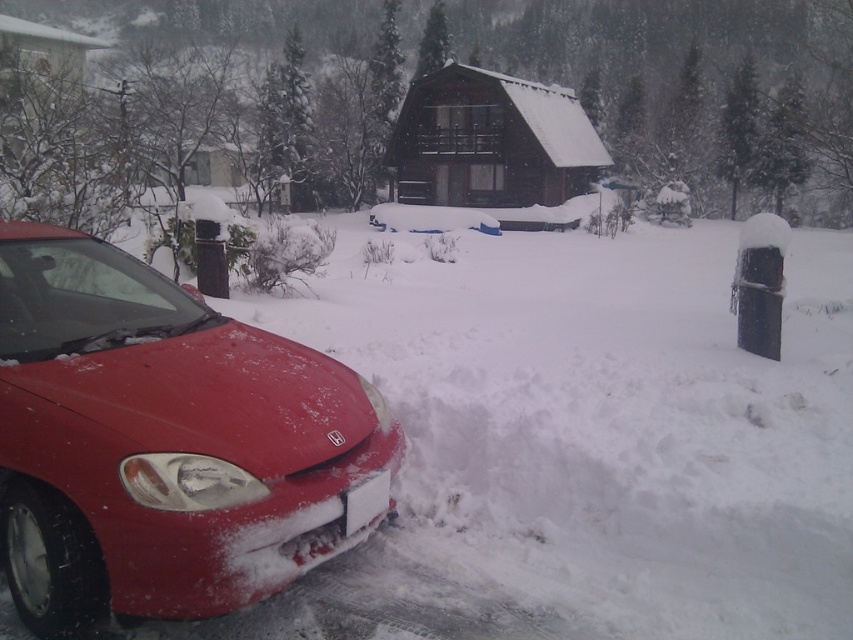
You are standing at point (363, 481) and want to walk to the cabin. Is point (424, 108) behind you or in front of you?

Point (424, 108) is behind point (363, 481), so it is behind you.

You are standing at the center of the snowy driveway and want to reach the cabin. Which direction should you walk relative to the point representing the matte red car at lower left located at coordinate point (x=161, y=442)?

Since the cabin is in the background behind the matte red car at lower left, you should walk in the direction away from the point representing the matte red car at lower left to reach the cabin.